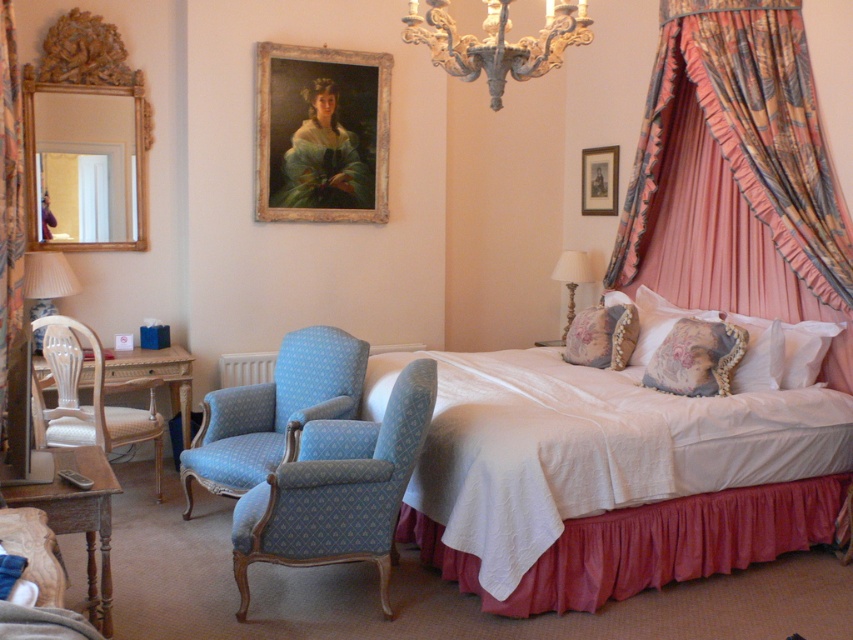
You are planning to place a new painting between the blue fabric armchair at center and the floral fabric pillow at bed right. According to the scene, which side of the armchair should the painting be placed on to align with the existing arrangement?

The blue fabric armchair at center is to the left of the floral fabric pillow at bed right, so the painting should be placed to the right side of the blue fabric armchair at center to align with the existing arrangement.